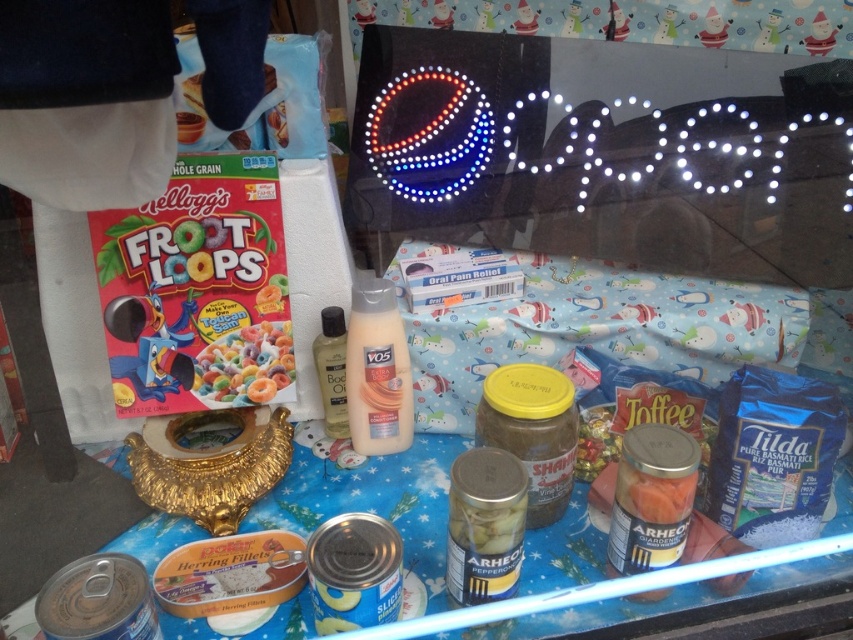
You are a customer at the store looking at the display case. You see a translucent plastic bottle at center and a bright yellow cereal at center. Which item is positioned lower in the display?

The translucent plastic bottle at center is positioned below the bright yellow cereal at center, so it is lower in the display.

You are a customer looking at the display case with the festive winter theme. You see a translucent plastic bottle at center and a bright yellow cereal at center. Which item is located to the right of the other?

The translucent plastic bottle at center is to the right of the bright yellow cereal at center.